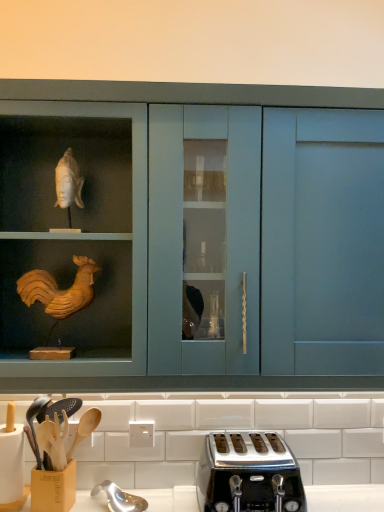
This screenshot has height=512, width=384. Find the location of `matte blue cabinet at center`. matte blue cabinet at center is located at coordinates (177, 229).

Describe the element at coordinates (177, 229) in the screenshot. I see `matte blue cabinet at center` at that location.

Locate an element on the screen. polished chrome toaster at lower center is located at coordinates (248, 474).

I want to click on matte blue cabinet at center, so click(177, 229).

From a real-world perspective, which is physically below, wooden utensil holder at lower left or polished chrome toaster at lower center?

In real-world perspective, polished chrome toaster at lower center is lower.

How distant is wooden utensil holder at lower left from polished chrome toaster at lower center?

27.52 inches.

From the image's perspective, would you say wooden utensil holder at lower left is positioned over polished chrome toaster at lower center?

A: Correct, wooden utensil holder at lower left appears higher than polished chrome toaster at lower center in the image.

Is wooden utensil holder at lower left facing away from polished chrome toaster at lower center?

No, wooden utensil holder at lower left is not facing away from polished chrome toaster at lower center.

Is point (13, 484) in front of point (158, 245)?

No.

From the image's perspective, which is below, wooden utensil holder at lower left or matte blue cabinet at center?

wooden utensil holder at lower left appears lower in the image.

What's the angular difference between matte blue cabinet at center and polished chrome toaster at lower center's facing directions?

The facing directions of matte blue cabinet at center and polished chrome toaster at lower center are 4.86 degrees apart.

Which of these two, matte blue cabinet at center or polished chrome toaster at lower center, is bigger?

matte blue cabinet at center.

Locate an element on the screen. This screenshot has width=384, height=512. toaster located on the right of matte blue cabinet at center is located at coordinates pyautogui.click(x=248, y=474).

Considering the sizes of objects matte blue cabinet at center and polished chrome toaster at lower center in the image provided, who is taller, matte blue cabinet at center or polished chrome toaster at lower center?

Standing taller between the two is matte blue cabinet at center.

Is polished chrome toaster at lower center far away from matte blue cabinet at center?

No, there isn't a large distance between polished chrome toaster at lower center and matte blue cabinet at center.

Does polished chrome toaster at lower center have a larger size compared to matte blue cabinet at center?

No.

Which of these two, polished chrome toaster at lower center or matte blue cabinet at center, stands taller?

Standing taller between the two is matte blue cabinet at center.

Looking at this image, is matte blue cabinet at center inside the boundaries of wooden utensil holder at lower left, or outside?

matte blue cabinet at center exists outside the volume of wooden utensil holder at lower left.

Would you say matte blue cabinet at center is a long distance from wooden utensil holder at lower left?

They are positioned close to each other.

Can you confirm if matte blue cabinet at center is positioned to the right of wooden utensil holder at lower left?

Yes.

Considering the positions of point (156, 190) and point (7, 474), is point (156, 190) closer or farther from the camera than point (7, 474)?

Point (156, 190).

From the image's perspective, which one is positioned higher, polished chrome toaster at lower center or wooden utensil holder at lower left?

wooden utensil holder at lower left, from the image's perspective.

Does polished chrome toaster at lower center have a lesser width compared to wooden utensil holder at lower left?

No, polished chrome toaster at lower center is not thinner than wooden utensil holder at lower left.

What are the coordinates of `toaster on the right of wooden utensil holder at lower left` in the screenshot? It's located at (248, 474).

Is polished chrome toaster at lower center bigger or smaller than wooden utensil holder at lower left?

Considering their sizes, polished chrome toaster at lower center takes up more space than wooden utensil holder at lower left.

The image size is (384, 512). I want to click on toaster on the right of wooden utensil holder at lower left, so click(248, 474).

Locate an element on the screen. cabinetry above the wooden utensil holder at lower left (from the image's perspective) is located at coordinates (177, 229).

Based on their spatial positions, is matte blue cabinet at center or wooden utensil holder at lower left closer to polished chrome toaster at lower center?

The object closer to polished chrome toaster at lower center is matte blue cabinet at center.

Considering their positions, is polished chrome toaster at lower center positioned closer to wooden utensil holder at lower left than matte blue cabinet at center?

polished chrome toaster at lower center is positioned closer to the anchor wooden utensil holder at lower left.

From the image, which object appears to be nearer to matte blue cabinet at center, wooden utensil holder at lower left or polished chrome toaster at lower center?

Among the two, polished chrome toaster at lower center is located nearer to matte blue cabinet at center.

Looking at the image, which one is located closer to wooden utensil holder at lower left, matte blue cabinet at center or polished chrome toaster at lower center?

polished chrome toaster at lower center.

Considering their positions, is polished chrome toaster at lower center positioned closer to matte blue cabinet at center than wooden utensil holder at lower left?

polished chrome toaster at lower center lies closer to matte blue cabinet at center than the other object.

Estimate the real-world distances between objects in this image. Which object is further from polished chrome toaster at lower center, wooden utensil holder at lower left or matte blue cabinet at center?

wooden utensil holder at lower left is positioned further to the anchor polished chrome toaster at lower center.

Identify the location of cabinetry between wooden utensil holder at lower left and polished chrome toaster at lower center from left to right. Image resolution: width=384 pixels, height=512 pixels. (177, 229).